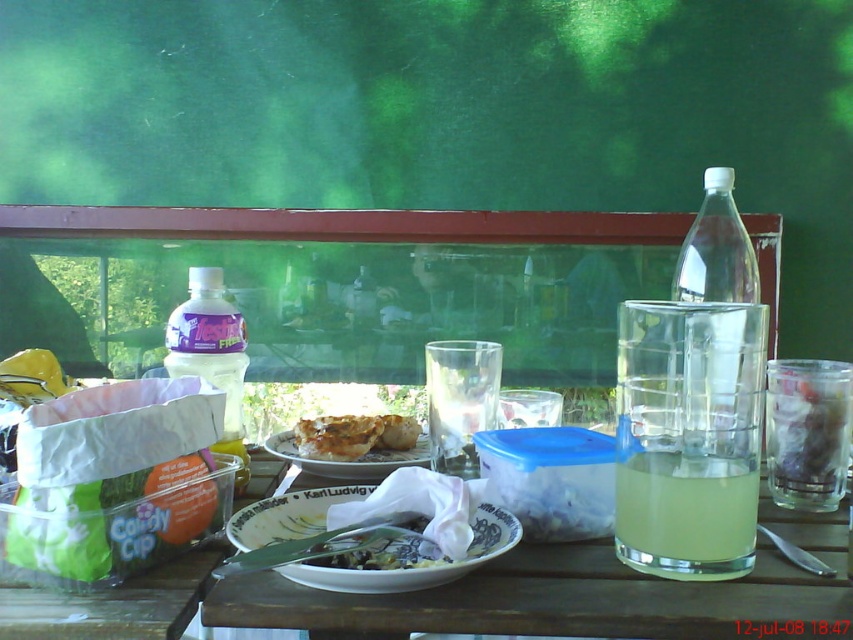
Looking at this image, does yellow translucent glass at right have a lesser width compared to white matte plate at center?

Yes, yellow translucent glass at right is thinner than white matte plate at center.

Based on the photo, between yellow translucent glass at right and white matte plate at center, which one has more height?

Standing taller between the two is yellow translucent glass at right.

Locate an element on the screen. The height and width of the screenshot is (640, 853). yellow translucent glass at right is located at coordinates (688, 436).

What are the coordinates of `yellow translucent glass at right` in the screenshot? It's located at (688, 436).

Between white paper plate at center and white matte plate at center, which one is positioned higher?

white matte plate at center is higher up.

Is white paper plate at center taller than white matte plate at center?

No, white paper plate at center is not taller than white matte plate at center.

Is point (367, 556) farther from viewer compared to point (418, 448)?

No, it is in front of (418, 448).

The width and height of the screenshot is (853, 640). Find the location of `white paper plate at center`. white paper plate at center is located at coordinates (407, 560).

Between yellow translucent glass at right and white paper plate at center, which one has more height?

yellow translucent glass at right is taller.

Which is more to the right, yellow translucent glass at right or white paper plate at center?

From the viewer's perspective, yellow translucent glass at right appears more on the right side.

Find the location of a particular element. yellow translucent glass at right is located at coordinates (688, 436).

Find the location of a particular element. This screenshot has height=640, width=853. yellow translucent glass at right is located at coordinates (688, 436).